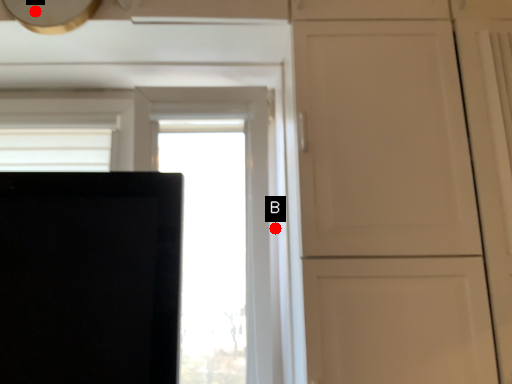
Question: Two points are circled on the image, labeled by A and B beside each circle. Which point is closer to the camera?

Choices:
 (A) A is closer
 (B) B is closer

Answer: (A)